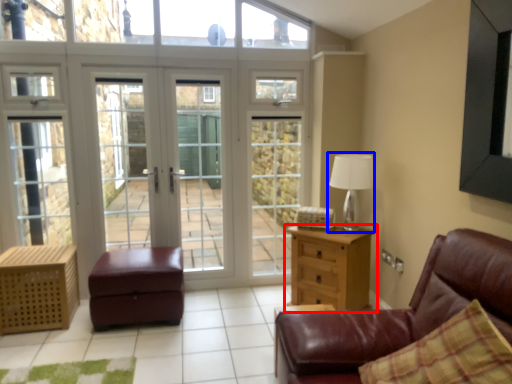
Question: Which object appears closest to the camera in this image, chest of drawers (highlighted by a red box) or table lamp (highlighted by a blue box)?

Choices:
 (A) chest of drawers
 (B) table lamp

Answer: (A)